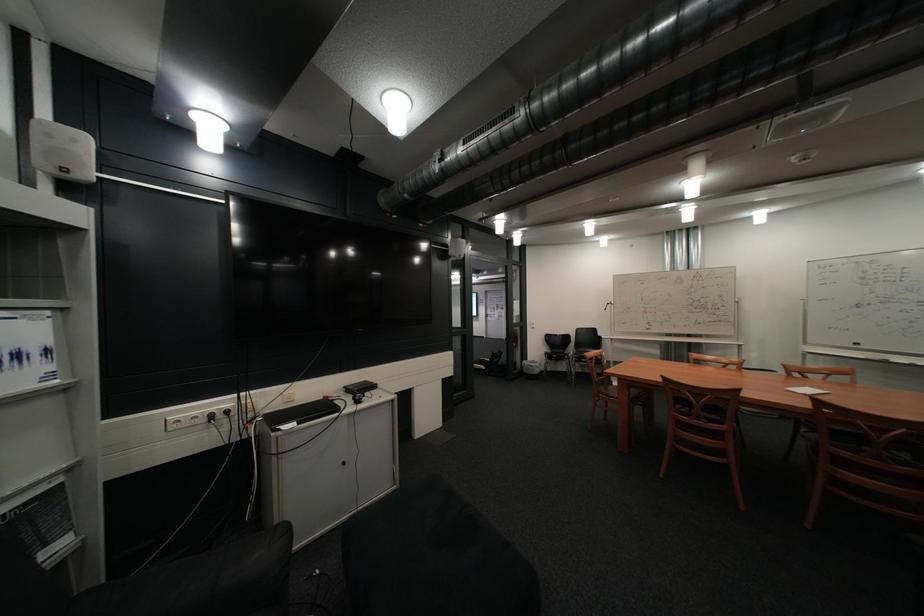
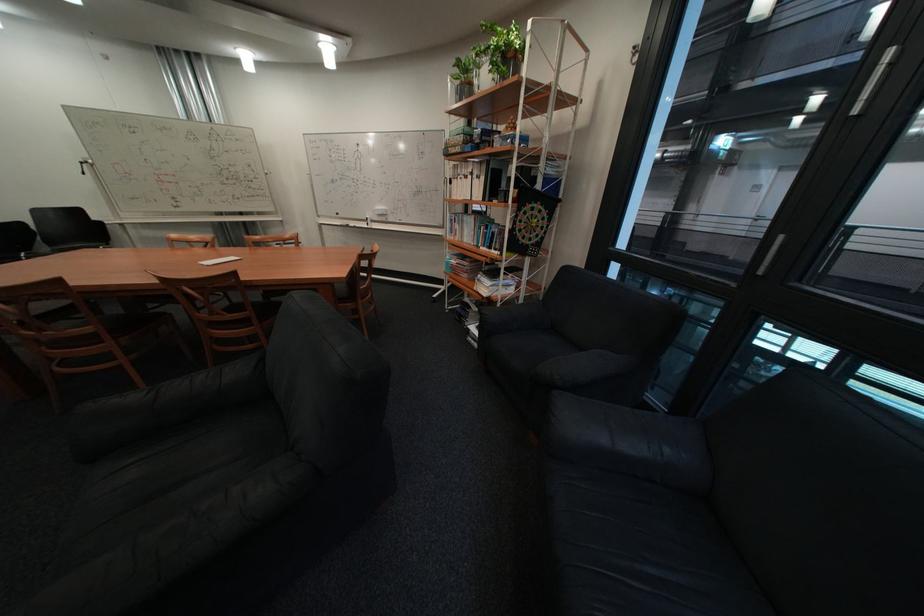
Where in the second image is the point corresponding to point (736, 453) from the first image?

(119, 358)